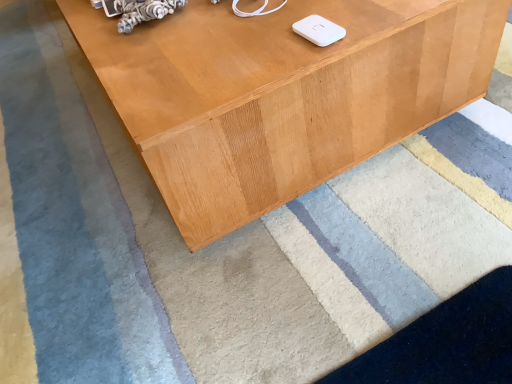
This screenshot has width=512, height=384. Identify the location of unoccupied space behind white matte ipod at upper center. (285, 6).